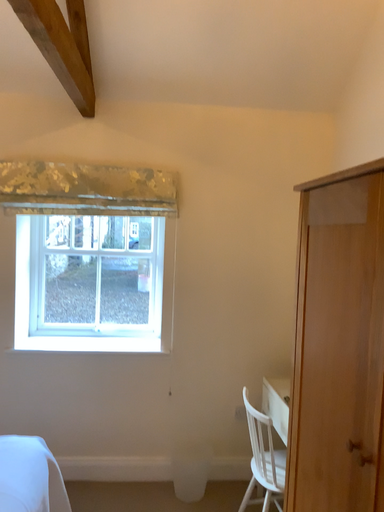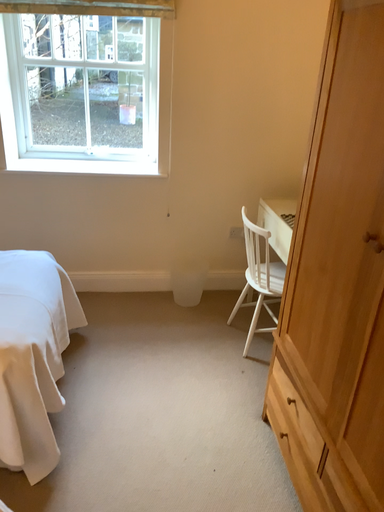
Question: How did the camera likely rotate when shooting the video?

Choices:
 (A) rotated upward
 (B) rotated downward

Answer: (B)